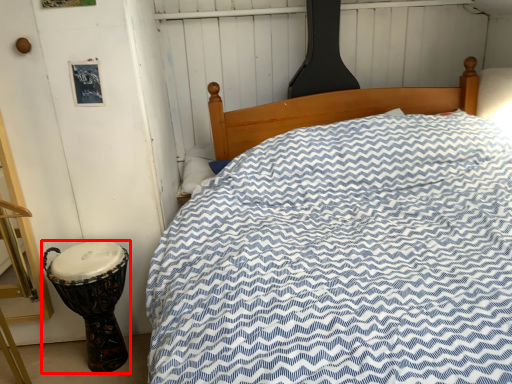
Question: From the image's perspective, what is the correct spatial relationship of drum (annotated by the red box) in relation to pillow?

Choices:
 (A) below
 (B) above

Answer: (A)